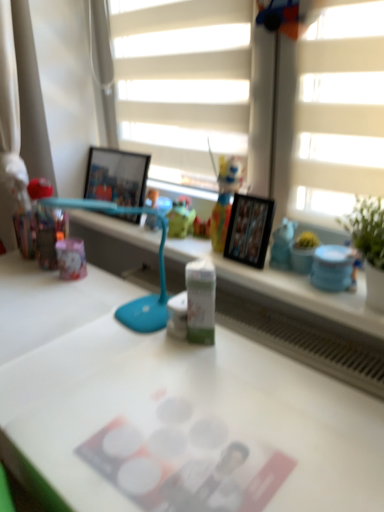
Locate an element on the screen. This screenshot has width=384, height=512. free space above white matte desk at center (from a real-world perspective) is located at coordinates (129, 368).